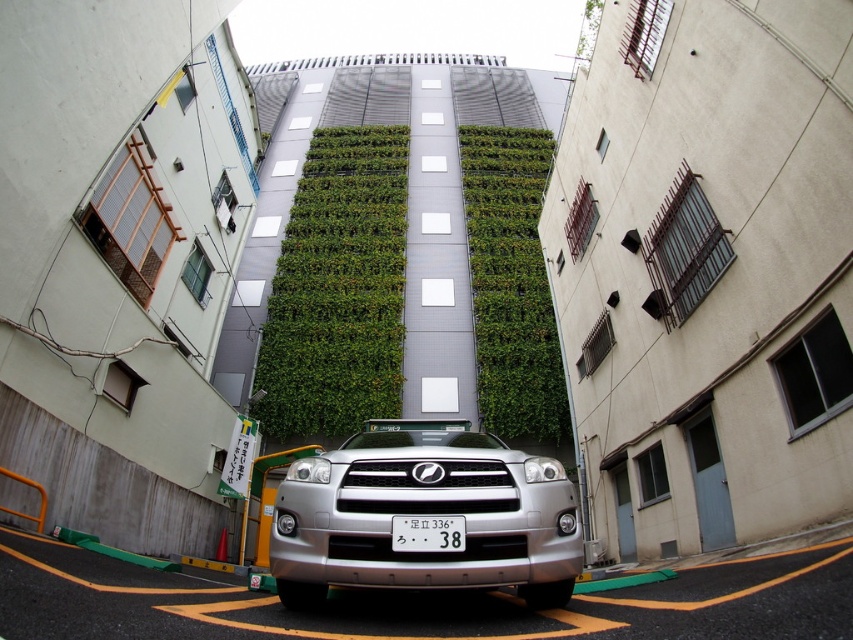
Question: Can you confirm if silver metallic suv at center is positioned to the right of green leafy wall at center?

Choices:
 (A) no
 (B) yes

Answer: (B)

Question: Which object is positioned closest to the green leafy wall at center?

Choices:
 (A) silver metallic car at center
 (B) silver metallic suv at center
 (C) white plastic license plate at center

Answer: (B)

Question: Can you confirm if silver metallic suv at center is thinner than white plastic license plate at center?

Choices:
 (A) no
 (B) yes

Answer: (A)

Question: Is silver metallic suv at center in front of green leafy wall at center?

Choices:
 (A) no
 (B) yes

Answer: (B)

Question: Which point appears farthest from the camera in this image?

Choices:
 (A) (569, 481)
 (B) (285, 346)
 (C) (410, 529)

Answer: (B)

Question: Which point is closer to the camera?

Choices:
 (A) (302, 193)
 (B) (39, 556)
 (C) (512, 504)
 (D) (453, 538)

Answer: (D)